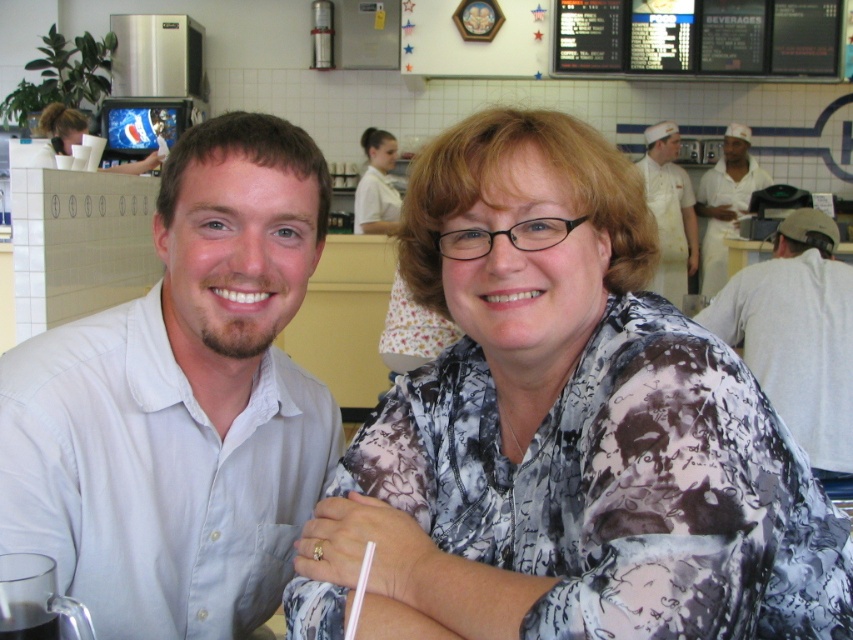
In the scene shown: Is printed fabric blouse at center to the right of gray cotton shirt at right from the viewer's perspective?

Incorrect, printed fabric blouse at center is not on the right side of gray cotton shirt at right.

Is point (596, 627) closer to camera compared to point (820, 348)?

Yes, point (596, 627) is closer to viewer.

The image size is (853, 640). Find the location of `printed fabric blouse at center`. printed fabric blouse at center is located at coordinates (564, 429).

Between printed fabric blouse at center and white plastic table at center, which one is positioned higher?

Positioned higher is white plastic table at center.

Can you confirm if printed fabric blouse at center is bigger than white plastic table at center?

Correct, printed fabric blouse at center is larger in size than white plastic table at center.

Who is more distant from viewer, (631, 611) or (735, 243)?

The point (735, 243) is behind.

Find the location of a particular element. The height and width of the screenshot is (640, 853). printed fabric blouse at center is located at coordinates (564, 429).

Who is positioned more to the right, gray cotton shirt at right or clear plastic cup at lower left?

Positioned to the right is gray cotton shirt at right.

Can you confirm if gray cotton shirt at right is positioned to the left of clear plastic cup at lower left?

Incorrect, gray cotton shirt at right is not on the left side of clear plastic cup at lower left.

Is point (749, 326) positioned in front of point (55, 637)?

No, (749, 326) is further to viewer.

Where is `gray cotton shirt at right`? gray cotton shirt at right is located at coordinates (798, 336).